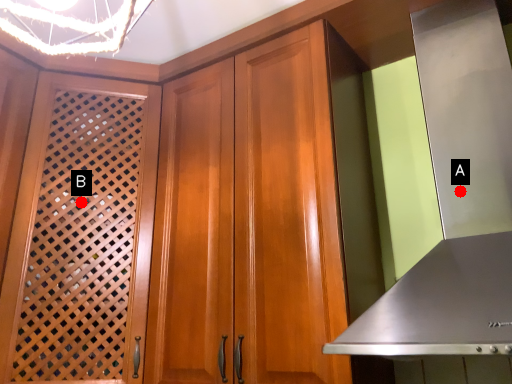
Question: Two points are circled on the image, labeled by A and B beside each circle. Which of the following is the closest to the observer?

Choices:
 (A) A is closer
 (B) B is closer

Answer: (A)